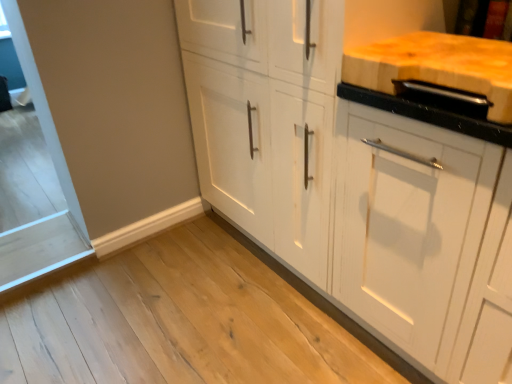
Question: Considering the relative sizes of white matte cabinet at center and natural wood cutting board at upper right in the image provided, is white matte cabinet at center smaller than natural wood cutting board at upper right?

Choices:
 (A) no
 (B) yes

Answer: (A)

Question: Is the depth of white matte cabinet at center greater than that of natural wood cutting board at upper right?

Choices:
 (A) yes
 (B) no

Answer: (A)

Question: Does white matte cabinet at center appear on the right side of natural wood cutting board at upper right?

Choices:
 (A) yes
 (B) no

Answer: (B)

Question: Is the position of white matte cabinet at center less distant than that of natural wood cutting board at upper right?

Choices:
 (A) no
 (B) yes

Answer: (A)

Question: From a real-world perspective, is white matte cabinet at center physically below natural wood cutting board at upper right?

Choices:
 (A) yes
 (B) no

Answer: (A)

Question: From the image's perspective, is white matte cabinet at center beneath natural wood cutting board at upper right?

Choices:
 (A) yes
 (B) no

Answer: (A)

Question: From the image's perspective, would you say natural wood cutting board at upper right is shown under white matte cabinet at center?

Choices:
 (A) no
 (B) yes

Answer: (A)

Question: Does natural wood cutting board at upper right have a lesser height compared to white matte cabinet at center?

Choices:
 (A) no
 (B) yes

Answer: (B)

Question: Is natural wood cutting board at upper right positioned behind white matte cabinet at center?

Choices:
 (A) yes
 (B) no

Answer: (B)

Question: Does natural wood cutting board at upper right have a greater height compared to white matte cabinet at center?

Choices:
 (A) yes
 (B) no

Answer: (B)

Question: Is natural wood cutting board at upper right at the left side of white matte cabinet at center?

Choices:
 (A) no
 (B) yes

Answer: (A)

Question: Can you confirm if natural wood cutting board at upper right is wider than white matte cabinet at center?

Choices:
 (A) no
 (B) yes

Answer: (A)

Question: From their relative heights in the image, would you say natural wood cutting board at upper right is taller or shorter than white matte cabinet at center?

Choices:
 (A) tall
 (B) short

Answer: (B)